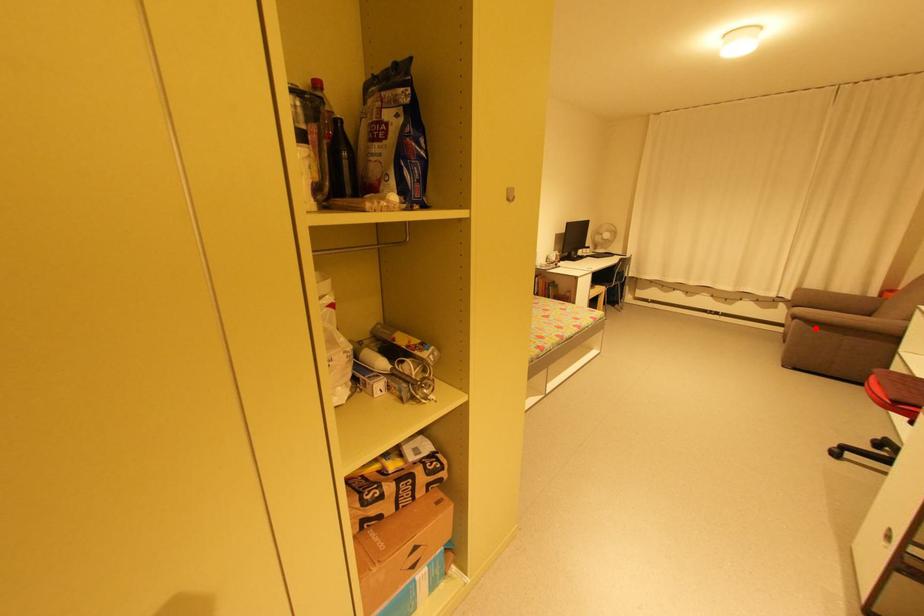
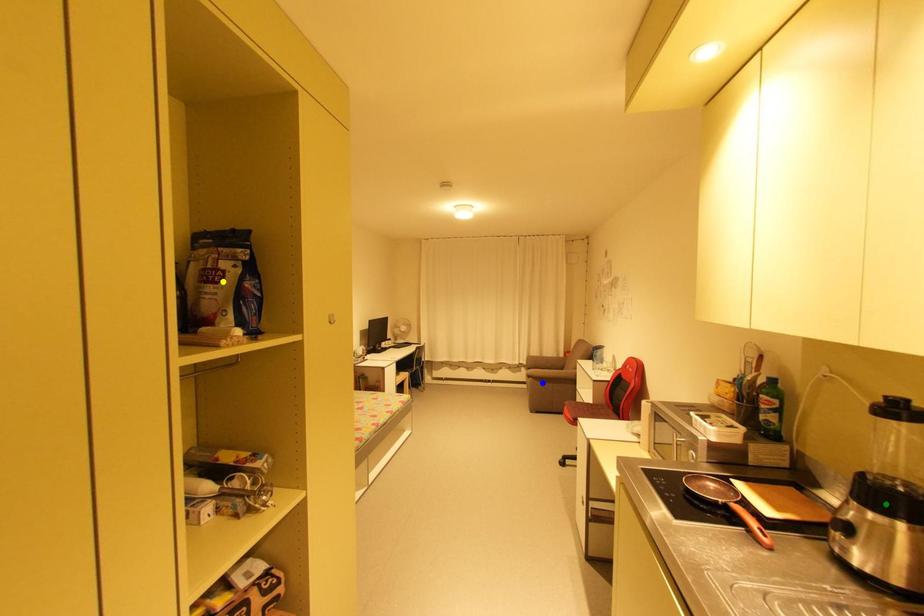
Question: I am providing you with two images of the same scene from different viewpoints. A red point is marked on the first image. You are given multiple points on the second image. Which mark in image 2 goes with the point in image 1?

Choices:
 (A) blue point
 (B) green point
 (C) yellow point

Answer: (A)